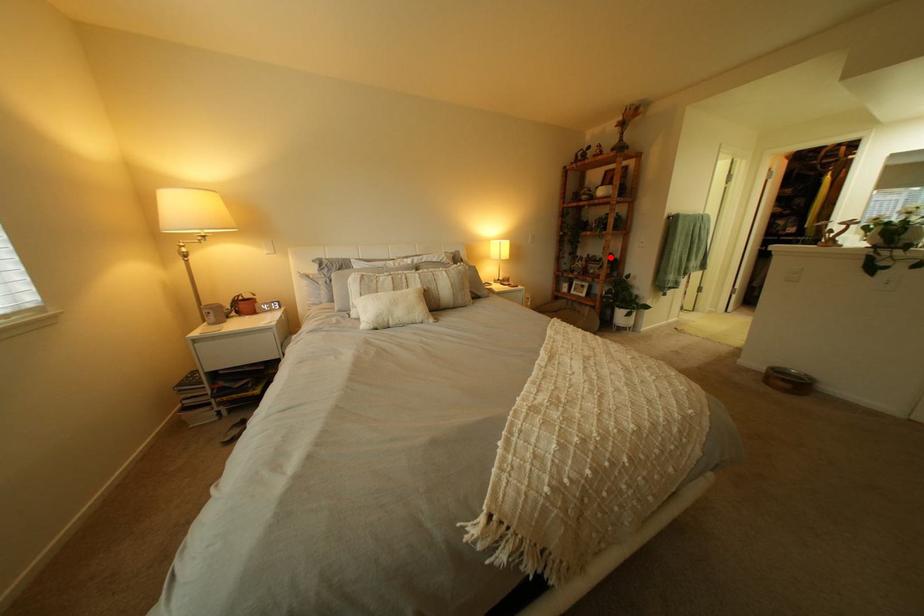
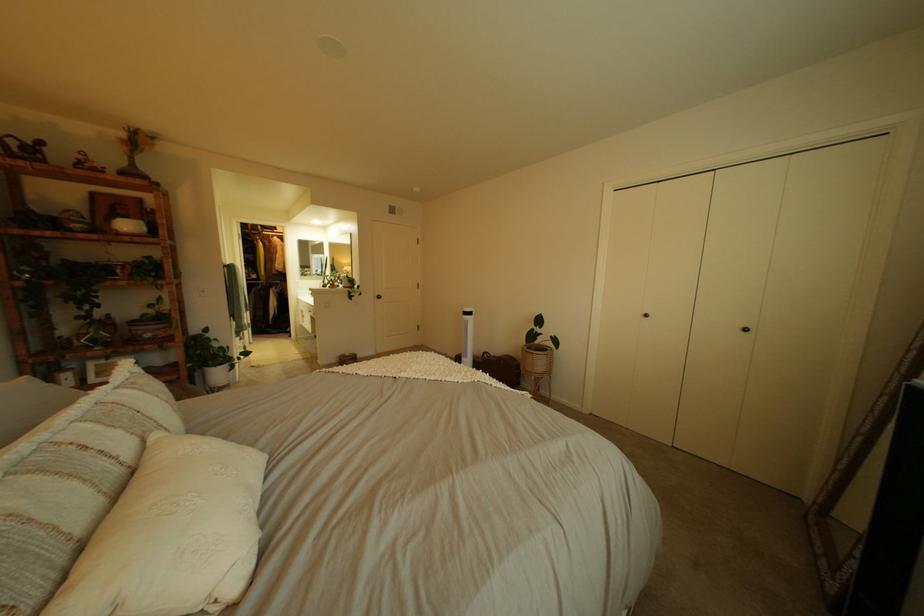
In the second image, find the point that corresponds to the highlighted location in the first image.

(161, 315)